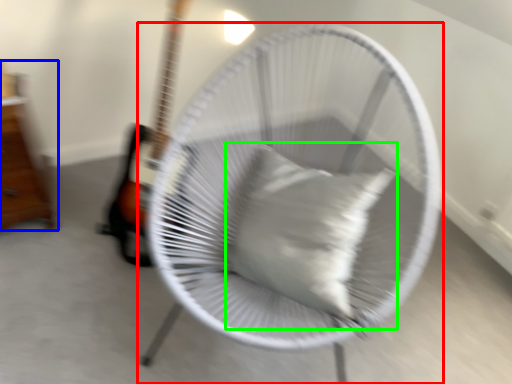
Question: Which is nearer to the mechanical fan (highlighted by a red box)? furniture (highlighted by a blue box) or pillow (highlighted by a green box).

Choices:
 (A) furniture
 (B) pillow

Answer: (B)